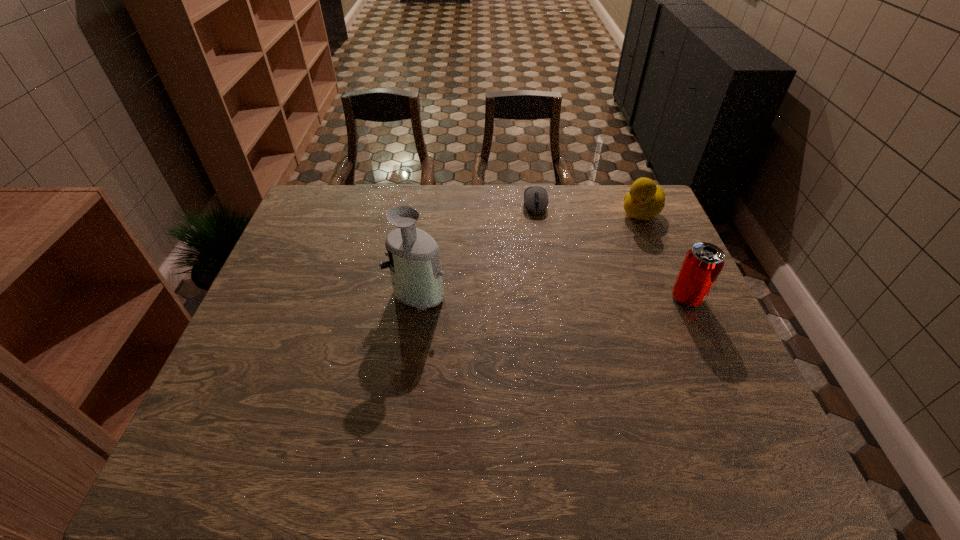
You are a GUI agent. You are given a task and a screenshot of the screen. Output one action in this format:
    pyautogui.click(x=<x>, y=<y>)
    Task: Click on the vacant area situated 0.300m on the front-facing side of the duck
    
    Given the screenshot: What is the action you would take?
    pyautogui.click(x=572, y=266)

Locate an element on the screen. Image resolution: width=960 pixels, height=540 pixels. vacant point located 0.220m on the wheel side of the computer equipment is located at coordinates (540, 262).

Locate an element on the screen. The height and width of the screenshot is (540, 960). free point located 0.070m on the wheel side of the computer equipment is located at coordinates (538, 230).

Find the location of a particular element. This screenshot has width=960, height=540. vacant space located on the wheel side of the computer equipment is located at coordinates (543, 293).

Find the location of a particular element. duck situated at the far edge is located at coordinates (645, 200).

Image resolution: width=960 pixels, height=540 pixels. I want to click on computer equipment present at the far edge, so click(x=535, y=198).

Find the location of a particular element. The width and height of the screenshot is (960, 540). soda can that is at the right edge is located at coordinates (703, 263).

Identify the location of duck present at the right edge. The height and width of the screenshot is (540, 960). (645, 200).

The width and height of the screenshot is (960, 540). I want to click on object located at the far right corner, so click(x=645, y=200).

At what (x,y) coordinates should I click in order to perform the action: click on vacant space at the far edge of the desktop. Please return your answer as a coordinate pair (x, y). This screenshot has width=960, height=540. Looking at the image, I should click on (565, 221).